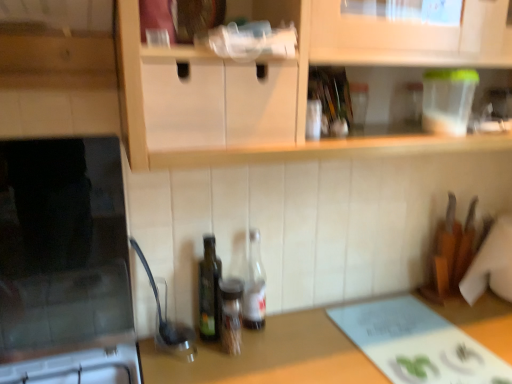
Question: Would you say brown wooden countertop at center is outside translucent glass bottle at center, the first bottle when ordered from right to left?

Choices:
 (A) no
 (B) yes

Answer: (B)

Question: Is brown wooden countertop at center thinner than translucent glass bottle at center, the first bottle when ordered from right to left?

Choices:
 (A) no
 (B) yes

Answer: (A)

Question: From the image's perspective, does brown wooden countertop at center appear higher than translucent glass bottle at center, the first bottle when ordered from right to left?

Choices:
 (A) no
 (B) yes

Answer: (A)

Question: Is brown wooden countertop at center shorter than translucent glass bottle at center, which appears as the 3th bottle when viewed from the left?

Choices:
 (A) no
 (B) yes

Answer: (A)

Question: Does brown wooden countertop at center lie behind translucent glass bottle at center, which appears as the 3th bottle when viewed from the left?

Choices:
 (A) yes
 (B) no

Answer: (B)

Question: Looking at their shapes, would you say brown wooden countertop at center is wider or thinner than translucent glass spice jar at center, which is the second bottle from right to left?

Choices:
 (A) wide
 (B) thin

Answer: (A)

Question: Based on their positions, is brown wooden countertop at center located to the left or right of translucent glass spice jar at center, which is the second bottle from right to left?

Choices:
 (A) left
 (B) right

Answer: (B)

Question: Would you say brown wooden countertop at center is inside or outside translucent glass spice jar at center, which is the second bottle from right to left?

Choices:
 (A) inside
 (B) outside

Answer: (B)

Question: Is point coord(229,369) closer or farther from the camera than point coord(221,336)?

Choices:
 (A) closer
 (B) farther

Answer: (A)

Question: In terms of size, does translucent glass spice jar at center, which is the second bottle in left-to-right order, appear bigger or smaller than black glass microwave at left?

Choices:
 (A) small
 (B) big

Answer: (A)

Question: In terms of width, does translucent glass spice jar at center, which is the second bottle from right to left, look wider or thinner when compared to black glass microwave at left?

Choices:
 (A) wide
 (B) thin

Answer: (B)

Question: Choose the correct answer: Is translucent glass spice jar at center, which is the second bottle in left-to-right order, inside black glass microwave at left or outside it?

Choices:
 (A) outside
 (B) inside

Answer: (A)

Question: In the image, is translucent glass spice jar at center, which is the second bottle from right to left, on the left side or the right side of black glass microwave at left?

Choices:
 (A) left
 (B) right

Answer: (B)

Question: Is point (230, 306) positioned closer to the camera than point (252, 244)?

Choices:
 (A) farther
 (B) closer

Answer: (B)

Question: From the image's perspective, is translucent glass spice jar at center, which is the second bottle in left-to-right order, above or below translucent glass bottle at center, the first bottle when ordered from right to left?

Choices:
 (A) below
 (B) above

Answer: (A)